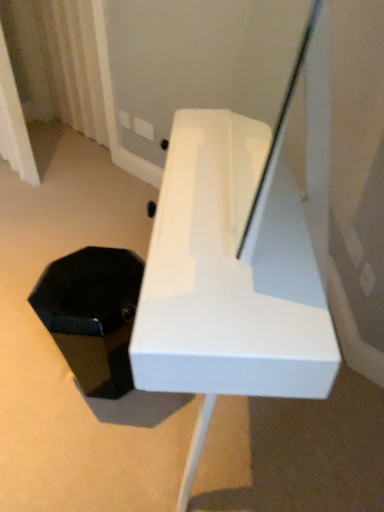
Locate an element on the screen. This screenshot has width=384, height=512. vacant space positioned to the left of black matte hexagonal box at lower left is located at coordinates (31, 366).